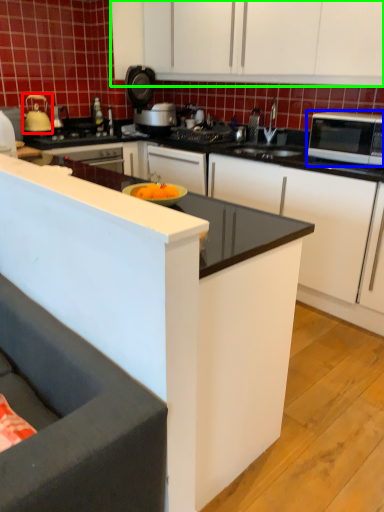
Question: Based on their relative distances, which object is farther from tea pot (highlighted by a red box)? Choose from microwave oven (highlighted by a blue box) and cabinetry (highlighted by a green box).

Choices:
 (A) microwave oven
 (B) cabinetry

Answer: (A)